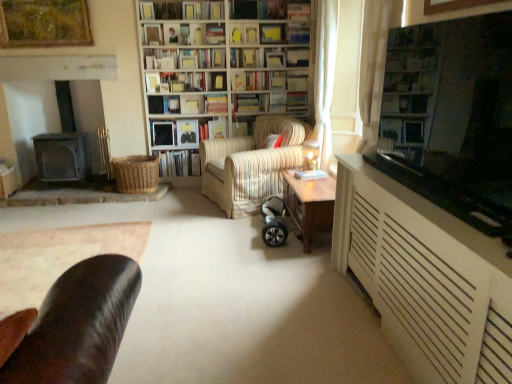
Question: Is point (174, 6) closer or farther from the camera than point (245, 109)?

Choices:
 (A) farther
 (B) closer

Answer: (B)

Question: From the image's perspective, is hardcover book at upper center, which is the 2th book in top-to-bottom order, positioned above or below hardcover books at center, which appears as the sixth book when ordered from the bottom?

Choices:
 (A) below
 (B) above

Answer: (B)

Question: Estimate the real-world distances between objects in this image. Which object is farther from the hardcover book at upper center, which is the fifth book in top-to-bottom order?

Choices:
 (A) hardcover book at center, which appears as the fourth book when ordered from the bottom
 (B) hardcover book at center, positioned as the fifth book in bottom-to-top order
 (C) white textured cabinet at right
 (D) transparent glass window screen at upper right
 (E) gold textured picture frame at upper left

Answer: (C)

Question: Which object is positioned closest to the silver metallic hoverboard at center?

Choices:
 (A) dark wood fireplace at left
 (B) hardcover book at upper center, which is the 2th book in top-to-bottom order
 (C) hardcover book at center, acting as the ninth book starting from the top
 (D) hardcover book at upper center, which ranks as the 10th book in bottom-to-top order
 (E) striped fabric armchair at center

Answer: (E)